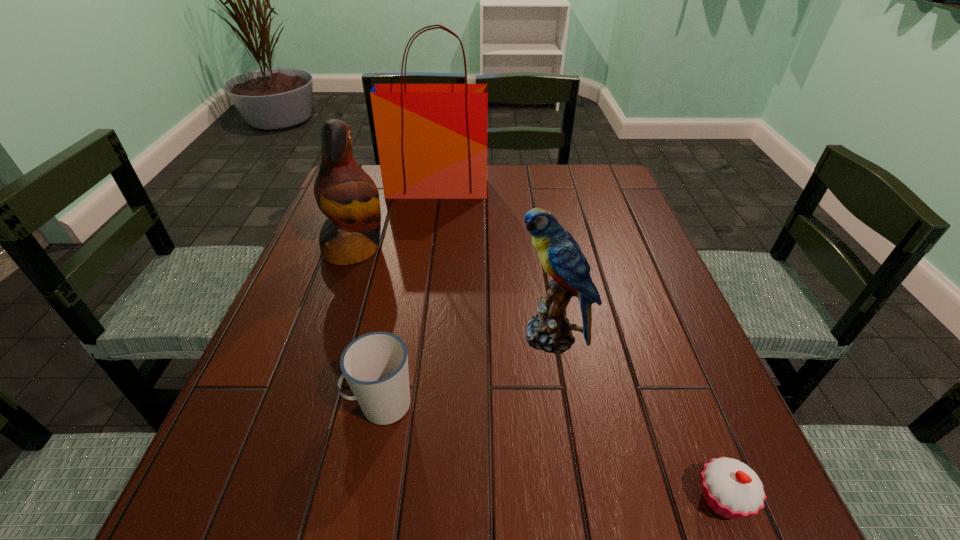
Where is `free space located 0.140m on the handle side of the farthest object`? This screenshot has height=540, width=960. free space located 0.140m on the handle side of the farthest object is located at coordinates (432, 228).

Where is `vacant space located 0.330m on the face of the second farthest object`? This screenshot has width=960, height=540. vacant space located 0.330m on the face of the second farthest object is located at coordinates (518, 249).

Where is `free space located on the face of the nearer parrot`? The height and width of the screenshot is (540, 960). free space located on the face of the nearer parrot is located at coordinates (348, 336).

I want to click on free space located on the face of the nearer parrot, so click(x=398, y=336).

This screenshot has height=540, width=960. I want to click on vacant space located 0.230m on the face of the nearer parrot, so click(403, 336).

Identify the location of vacant region located with a handle on the side of the second shortest object. This screenshot has width=960, height=540. (245, 404).

The image size is (960, 540). In order to click on vacant point located with a handle on the side of the second shortest object in this screenshot , I will do `click(273, 404)`.

Identify the location of blank space located 0.360m on the back of the nearest object. Image resolution: width=960 pixels, height=540 pixels. (647, 306).

Locate an element on the screen. This screenshot has height=540, width=960. object that is at the far edge is located at coordinates (432, 138).

Where is `object present at the near edge`? object present at the near edge is located at coordinates point(732,489).